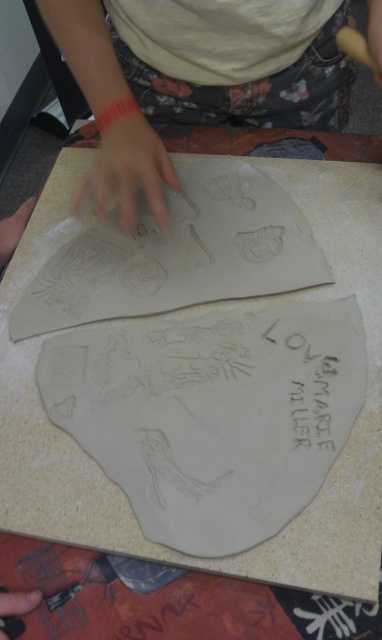
You are an art student observing the clay modeling scene. You notice the matte gray clay hand at upper left and the smooth skin at center. Which object is smaller in size?

The matte gray clay hand at upper left is smaller than the smooth skin at center.

From the picture: You are a sculptor standing 24 inches away from a workbench. You want to reach the matte clay hand at center to make adjustments. Can you comfortably reach it without moving your position?

The matte clay hand at center is 21.80 inches away from the viewer, so yes, you can comfortably reach it since it is within the 24 inches distance you are standing from the workbench.